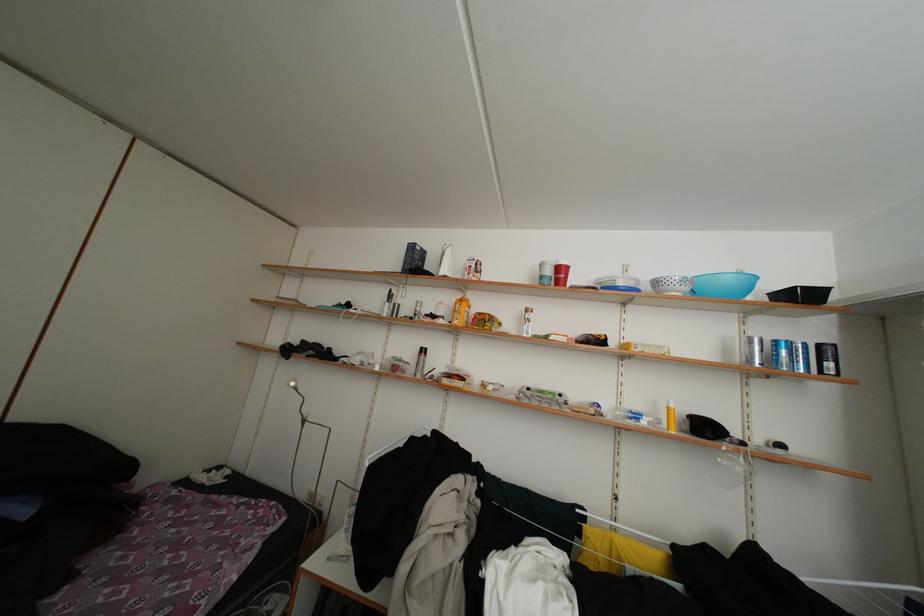
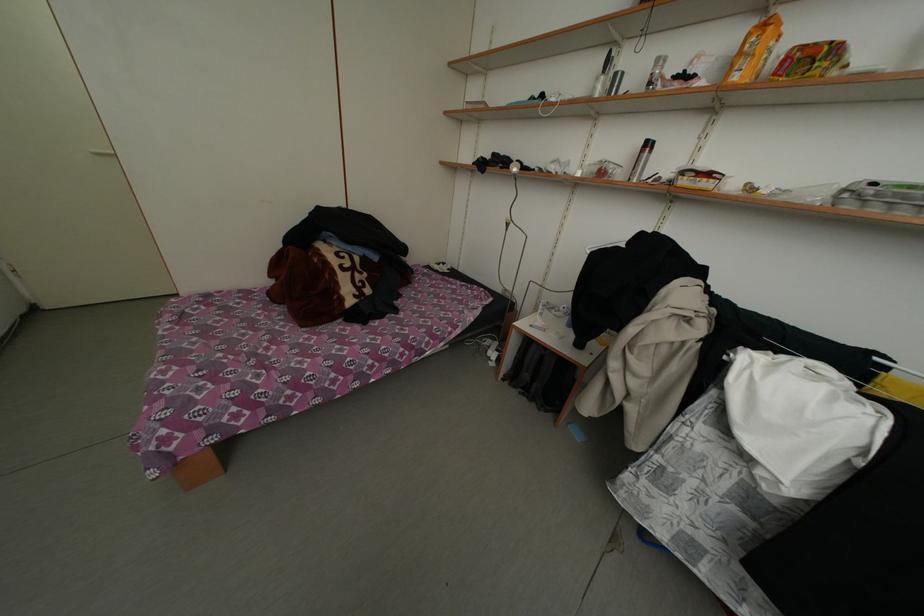
Locate, in the second image, the point that corresponds to pixel 391 314 in the first image.

(602, 94)